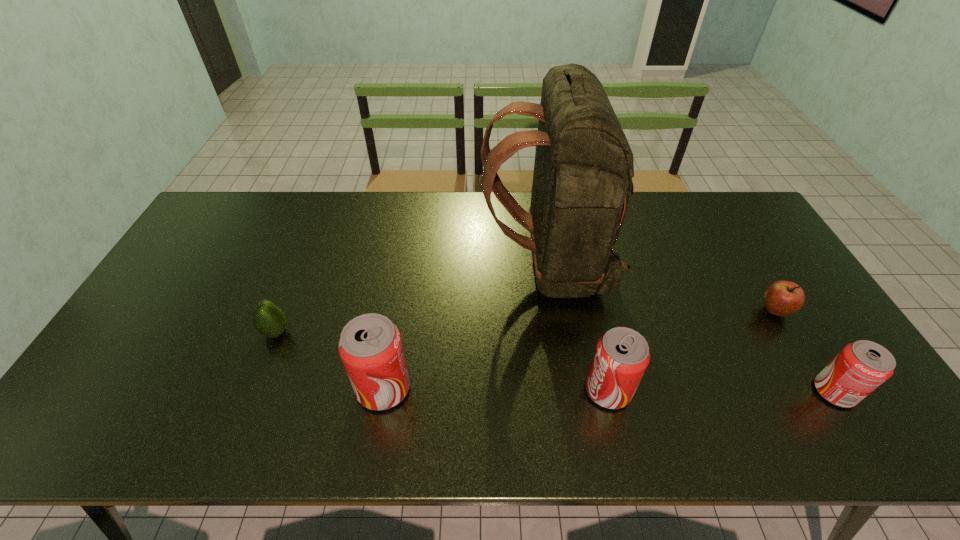
Locate an element on the screen. The width and height of the screenshot is (960, 540). the fifth object from right to left is located at coordinates click(370, 346).

Identify the location of the second soda can from right to left. (622, 355).

Find the location of a particular element. The width and height of the screenshot is (960, 540). the third tallest object is located at coordinates (622, 355).

The image size is (960, 540). Find the location of `the rightmost soda can`. the rightmost soda can is located at coordinates (860, 367).

Where is `the shortest soda can`? Image resolution: width=960 pixels, height=540 pixels. the shortest soda can is located at coordinates (860, 367).

In order to click on the leftmost object in this screenshot , I will do `click(269, 320)`.

Find the location of a particular element. This screenshot has width=960, height=540. backpack is located at coordinates click(582, 184).

Where is `apple`? The height and width of the screenshot is (540, 960). apple is located at coordinates (782, 298).

Identify the location of free region located 0.090m on the left of the leftmost soda can. (319, 388).

This screenshot has height=540, width=960. In order to click on free space located on the left of the second soda can from left to right in this screenshot , I will do `click(564, 390)`.